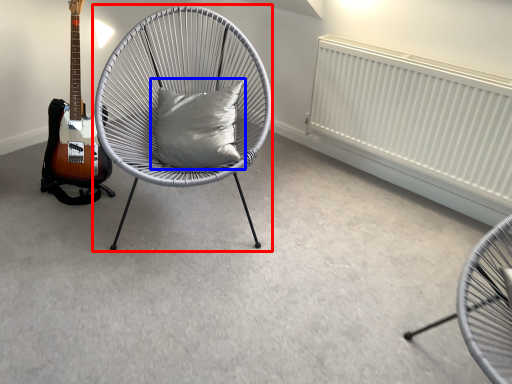
Question: Which object appears closest to the camera in this image, chair (highlighted by a red box) or pillow (highlighted by a blue box)?

Choices:
 (A) chair
 (B) pillow

Answer: (A)